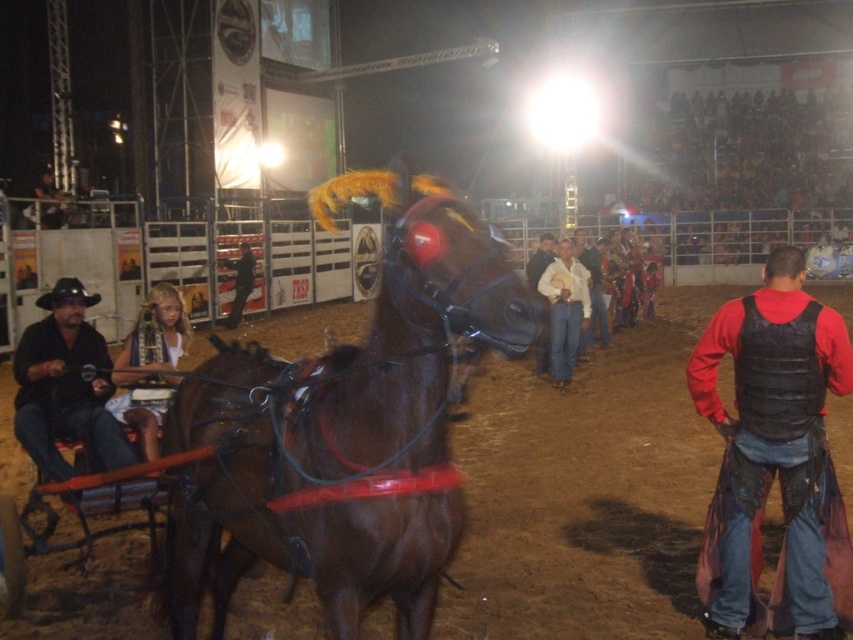
In the scene shown: Does matte black cowboy hat at left appear under white fabric headband at left?

No.

Is matte black cowboy hat at left to the right of white fabric headband at left from the viewer's perspective?

In fact, matte black cowboy hat at left is to the left of white fabric headband at left.

Is point (79, 371) more distant than point (184, 321)?

That is False.

The height and width of the screenshot is (640, 853). Identify the location of matte black cowboy hat at left. (65, 385).

Who is more distant from viewer, (775, 316) or (119, 404)?

The point (119, 404) is behind.

Locate an element on the screen. This screenshot has width=853, height=640. red leather vest at right is located at coordinates (775, 458).

Is point (415, 328) positioned after point (817, 419)?

No, (415, 328) is in front of (817, 419).

Who is taller, brown glossy horse at center or red leather vest at right?

Standing taller between the two is red leather vest at right.

You are a GUI agent. You are given a task and a screenshot of the screen. Output one action in this format:
    pyautogui.click(x=<x>, y=<y>)
    Task: Click on the brown glossy horse at center
    Image resolution: width=853 pixels, height=640 pixels.
    Given the screenshot: What is the action you would take?
    pyautogui.click(x=344, y=428)